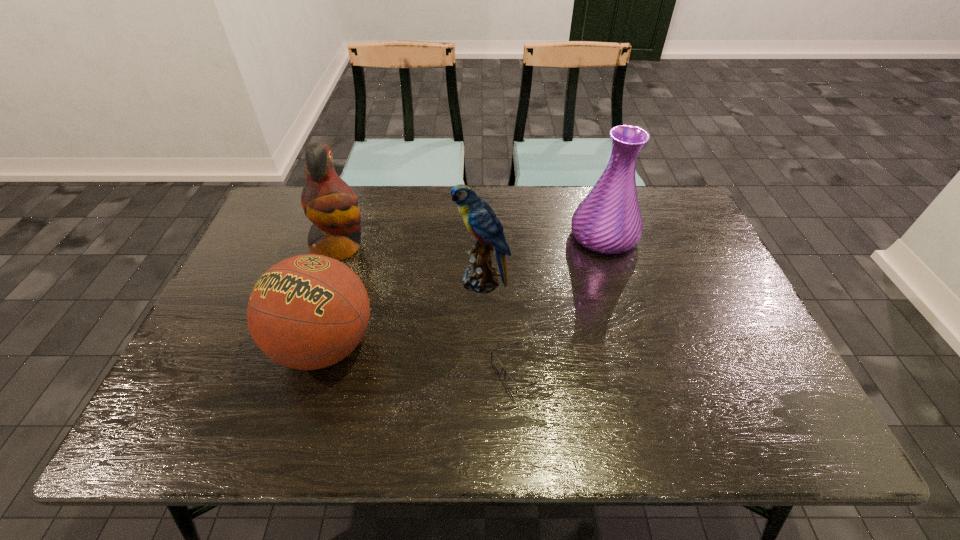
This screenshot has width=960, height=540. I want to click on the left parrot, so click(328, 202).

Locate an element on the screen. This screenshot has height=540, width=960. vase is located at coordinates (608, 220).

You are a GUI agent. You are given a task and a screenshot of the screen. Output one action in this format:
    pyautogui.click(x=<x>, y=<y>)
    Task: Click on the right parrot
    Image resolution: width=960 pixels, height=540 pixels.
    Given the screenshot: What is the action you would take?
    pyautogui.click(x=480, y=219)

The height and width of the screenshot is (540, 960). In order to click on the third farthest object in this screenshot , I will do `click(480, 219)`.

Image resolution: width=960 pixels, height=540 pixels. Find the location of `the fourth tallest object`. the fourth tallest object is located at coordinates (307, 312).

Where is `spectacles`? The height and width of the screenshot is (540, 960). spectacles is located at coordinates (497, 364).

Where is `vacant region located on the face of the left parrot`? vacant region located on the face of the left parrot is located at coordinates (465, 248).

This screenshot has width=960, height=540. In order to click on vacant space situated 0.190m on the right of the rightmost object in this screenshot , I will do `click(700, 237)`.

The image size is (960, 540). What are the coordinates of `free region located on the face of the right parrot` in the screenshot? It's located at (379, 281).

Identify the location of vacant space located 0.230m on the face of the right parrot. The width and height of the screenshot is (960, 540). click(372, 281).